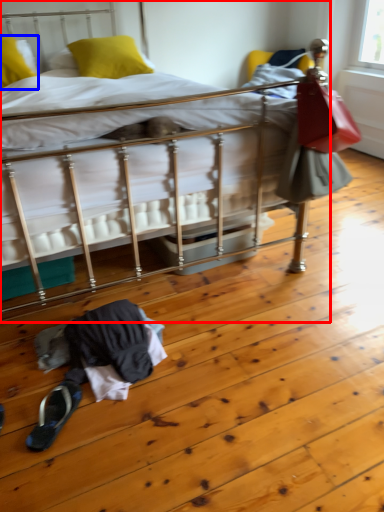
Question: Among these objects, which one is nearest to the camera, bed (highlighted by a red box) or pillow (highlighted by a blue box)?

Choices:
 (A) bed
 (B) pillow

Answer: (A)